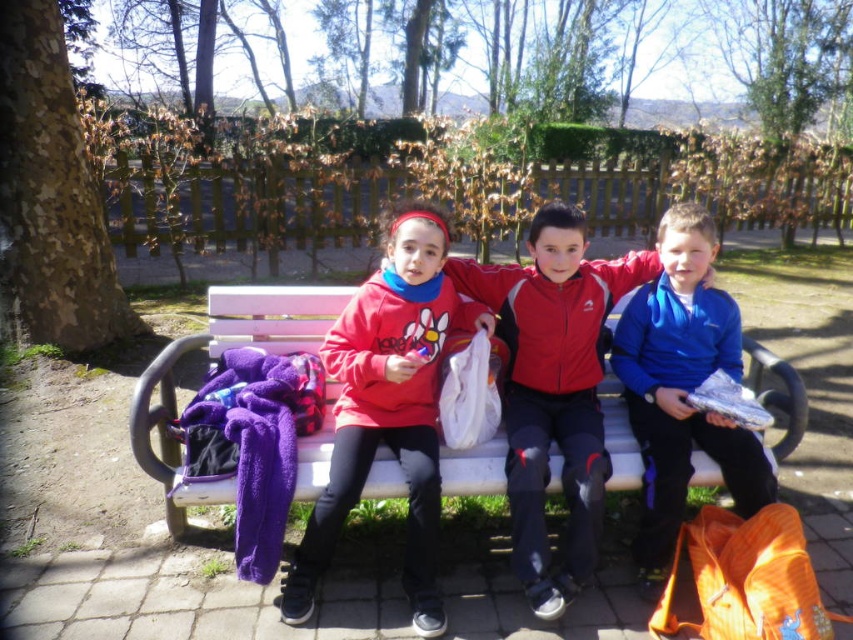
In the scene shown: Does red matte jacket at center come in front of blue fleece jacket at right?

Yes, it is.

The width and height of the screenshot is (853, 640). I want to click on red matte jacket at center, so click(553, 387).

You are a GUI agent. You are given a task and a screenshot of the screen. Output one action in this format:
    pyautogui.click(x=<x>, y=<y>)
    Task: Click on the red matte jacket at center
    Image resolution: width=853 pixels, height=640 pixels.
    Given the screenshot: What is the action you would take?
    pyautogui.click(x=553, y=387)

Who is positioned more to the right, red matte jacket at center or white wooden bench at center?

red matte jacket at center is more to the right.

I want to click on red matte jacket at center, so click(x=553, y=387).

Identify the location of matte red hoodie at center. This screenshot has height=640, width=853. (387, 406).

Between matte red hoodie at center and blue fleece jacket at right, which one is positioned higher?

blue fleece jacket at right is higher up.

Which is in front, point (410, 563) or point (647, 572)?

Point (410, 563) is more forward.

The image size is (853, 640). What are the coordinates of `matte red hoodie at center` in the screenshot? It's located at (387, 406).